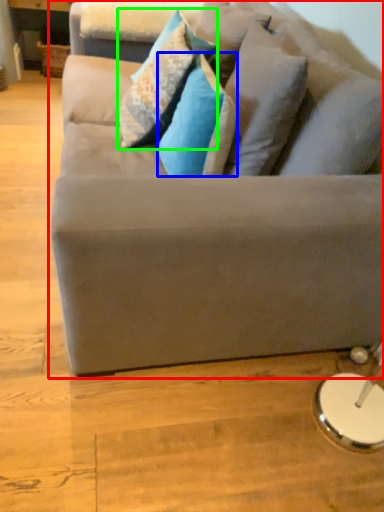
Question: Based on their relative distances, which object is nearer to studio couch (highlighted by a red box)? Choose from pillow (highlighted by a blue box) and pillow (highlighted by a green box).

Choices:
 (A) pillow
 (B) pillow

Answer: (A)